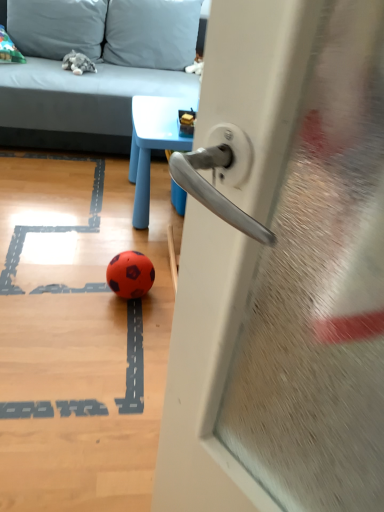
Question: From the image's perspective, is soft gray pillow at upper left, acting as the second pillow starting from the right, over blue plastic table at upper center?

Choices:
 (A) yes
 (B) no

Answer: (A)

Question: Is soft gray pillow at upper left, arranged as the first pillow when viewed from the left, facing away from blue plastic table at upper center?

Choices:
 (A) no
 (B) yes

Answer: (A)

Question: From the image's perspective, is soft gray pillow at upper left, acting as the second pillow starting from the right, below blue plastic table at upper center?

Choices:
 (A) yes
 (B) no

Answer: (B)

Question: Are soft gray pillow at upper left, acting as the second pillow starting from the right, and blue plastic table at upper center making contact?

Choices:
 (A) yes
 (B) no

Answer: (B)

Question: Does soft gray pillow at upper left, acting as the second pillow starting from the right, have a greater height compared to blue plastic table at upper center?

Choices:
 (A) no
 (B) yes

Answer: (A)

Question: In the image, is soft gray pillow at upper center, placed as the first pillow when sorted from right to left, on the left side or the right side of rubber soccer ball at center?

Choices:
 (A) right
 (B) left

Answer: (B)

Question: In terms of size, does soft gray pillow at upper center, placed as the first pillow when sorted from right to left, appear bigger or smaller than rubber soccer ball at center?

Choices:
 (A) big
 (B) small

Answer: (A)

Question: Is point (117, 10) positioned closer to the camera than point (132, 296)?

Choices:
 (A) farther
 (B) closer

Answer: (A)

Question: From the image's perspective, relative to rubber soccer ball at center, is soft gray pillow at upper center, placed as the first pillow when sorted from right to left, above or below?

Choices:
 (A) above
 (B) below

Answer: (A)

Question: Looking at their shapes, would you say gray fabric couch at upper left is wider or thinner than soft gray pillow at upper center, placed as the first pillow when sorted from right to left?

Choices:
 (A) thin
 (B) wide

Answer: (B)

Question: In the image, is gray fabric couch at upper left positioned in front of or behind soft gray pillow at upper center, placed as the first pillow when sorted from right to left?

Choices:
 (A) behind
 (B) front

Answer: (B)

Question: Is gray fabric couch at upper left to the left or to the right of soft gray pillow at upper center, placed as the first pillow when sorted from right to left, in the image?

Choices:
 (A) right
 (B) left

Answer: (B)

Question: Is gray fabric couch at upper left bigger or smaller than soft gray pillow at upper center, placed as the first pillow when sorted from right to left?

Choices:
 (A) small
 (B) big

Answer: (B)

Question: In terms of size, does gray fabric couch at upper left appear bigger or smaller than rubber soccer ball at center?

Choices:
 (A) small
 (B) big

Answer: (B)

Question: Is point (34, 122) positioned closer to the camera than point (120, 259)?

Choices:
 (A) closer
 (B) farther

Answer: (B)